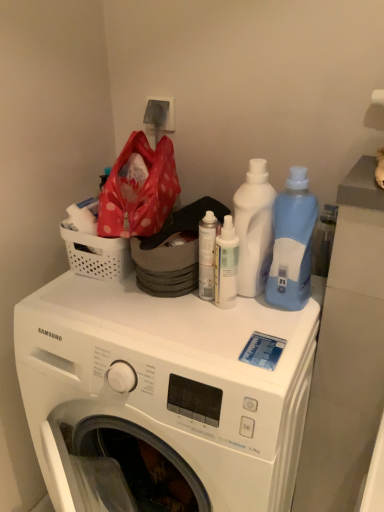
Question: From a real-world perspective, is white glossy spray can at center, arranged as the first cleaning product when viewed from the left, positioned over white perforated basket at upper left based on gravity?

Choices:
 (A) no
 (B) yes

Answer: (A)

Question: Does white glossy spray can at center, arranged as the 3th cleaning product when viewed from the right, have a lesser height compared to white perforated basket at upper left?

Choices:
 (A) no
 (B) yes

Answer: (A)

Question: Does white glossy spray can at center, arranged as the first cleaning product when viewed from the left, have a lesser width compared to white perforated basket at upper left?

Choices:
 (A) no
 (B) yes

Answer: (B)

Question: Could you tell me if white glossy spray can at center, arranged as the first cleaning product when viewed from the left, is facing white perforated basket at upper left?

Choices:
 (A) yes
 (B) no

Answer: (B)

Question: Is white glossy spray can at center, arranged as the 3th cleaning product when viewed from the right, behind white perforated basket at upper left?

Choices:
 (A) yes
 (B) no

Answer: (B)

Question: In terms of size, does white matte spray can at center appear bigger or smaller than white plastic washing machine at center?

Choices:
 (A) small
 (B) big

Answer: (A)

Question: Considering the positions of point (203, 261) and point (49, 289), is point (203, 261) closer or farther from the camera than point (49, 289)?

Choices:
 (A) closer
 (B) farther

Answer: (A)

Question: Considering the positions of white matte spray can at center and white plastic washing machine at center in the image, is white matte spray can at center wider or thinner than white plastic washing machine at center?

Choices:
 (A) thin
 (B) wide

Answer: (A)

Question: From a real-world perspective, is white matte spray can at center positioned above or below white plastic washing machine at center?

Choices:
 (A) above
 (B) below

Answer: (A)

Question: Choose the correct answer: Is blue translucent bottle at right, acting as the 3th cleaning product starting from the left, inside white plastic bottle at center, positioned as the second cleaning product in right-to-left order, or outside it?

Choices:
 (A) inside
 (B) outside

Answer: (B)

Question: In the image, is blue translucent bottle at right, acting as the 3th cleaning product starting from the left, positioned in front of or behind white plastic bottle at center, acting as the second cleaning product starting from the left?

Choices:
 (A) behind
 (B) front

Answer: (B)

Question: Considering the positions of blue translucent bottle at right, acting as the 3th cleaning product starting from the left, and white plastic bottle at center, positioned as the second cleaning product in right-to-left order, in the image, is blue translucent bottle at right, acting as the 3th cleaning product starting from the left, taller or shorter than white plastic bottle at center, positioned as the second cleaning product in right-to-left order,?

Choices:
 (A) short
 (B) tall

Answer: (A)

Question: From a real-world perspective, is blue translucent bottle at right, acting as the 3th cleaning product starting from the left, above or below white plastic bottle at center, positioned as the second cleaning product in right-to-left order?

Choices:
 (A) above
 (B) below

Answer: (A)

Question: In the image, is blue translucent bottle at right, which is the 1th cleaning product in right-to-left order, on the left side or the right side of white glossy spray can at center, arranged as the 3th cleaning product when viewed from the right?

Choices:
 (A) right
 (B) left

Answer: (A)

Question: Is blue translucent bottle at right, acting as the 3th cleaning product starting from the left, bigger or smaller than white glossy spray can at center, arranged as the 3th cleaning product when viewed from the right?

Choices:
 (A) small
 (B) big

Answer: (B)